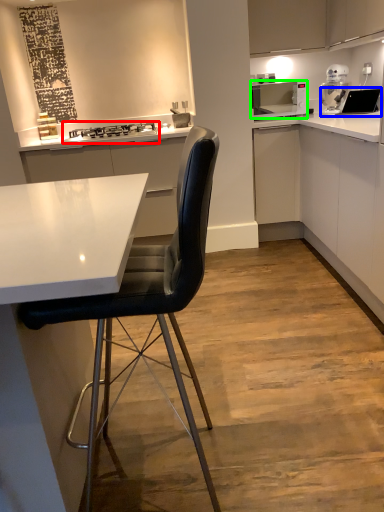
Question: Which object is positioned closest to stove (highlighted by a red box)? Select from sink (highlighted by a blue box) and home appliance (highlighted by a green box).

Choices:
 (A) sink
 (B) home appliance

Answer: (B)